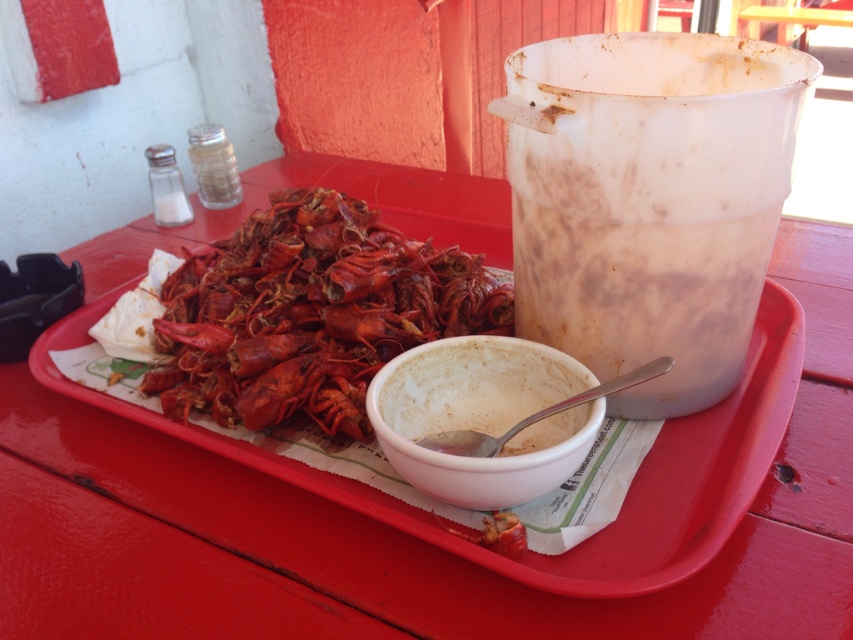
Question: Is white plastic cup at upper right wider than matte white bowl at center?

Choices:
 (A) yes
 (B) no

Answer: (B)

Question: Is white plastic cup at upper right smaller than white matte bowl at center?

Choices:
 (A) yes
 (B) no

Answer: (B)

Question: Which of the following is the closest to the observer?

Choices:
 (A) (567, 262)
 (B) (497, 570)
 (C) (444, 472)

Answer: (B)

Question: Can you confirm if shiny red lobster at center is positioned below white matte bowl at center?

Choices:
 (A) no
 (B) yes

Answer: (A)

Question: Which of the following is the closest to the observer?

Choices:
 (A) coord(543,385)
 (B) coord(239,237)

Answer: (A)

Question: Which of the following is the closest to the observer?

Choices:
 (A) matte white bowl at center
 (B) shiny red lobster at center

Answer: (A)